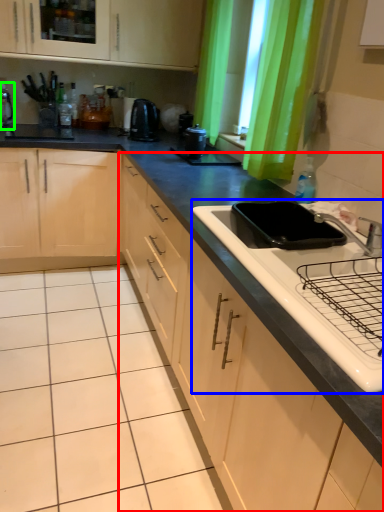
Question: Which object is the closest to the cabinetry (highlighted by a red box)? Choose among these: sink (highlighted by a blue box) or appliance (highlighted by a green box).

Choices:
 (A) sink
 (B) appliance

Answer: (A)